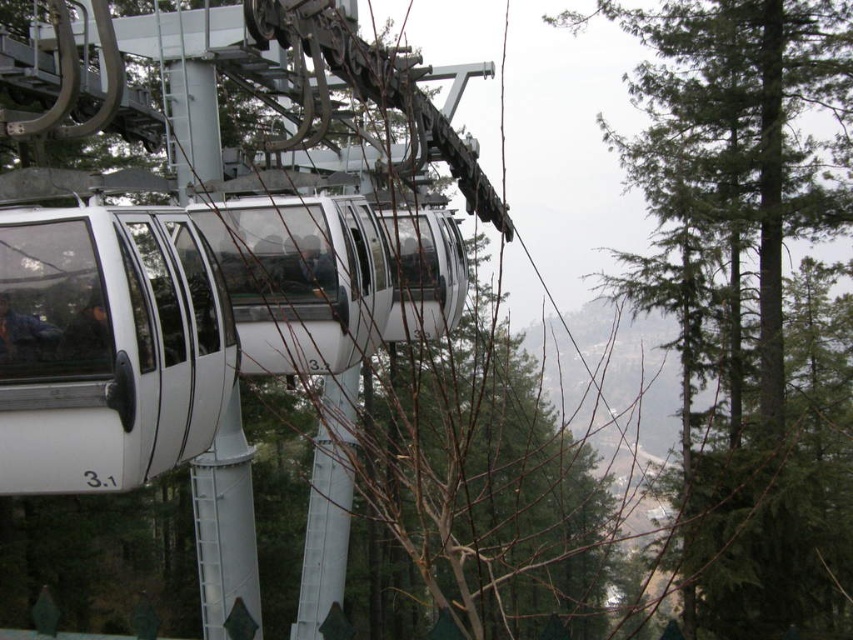
Is white glossy cable car at center above bare branches at center?

Yes.

The width and height of the screenshot is (853, 640). What do you see at coordinates (107, 346) in the screenshot? I see `white glossy cable car at center` at bounding box center [107, 346].

At what (x,y) coordinates should I click in order to perform the action: click on white glossy cable car at center. Please return your answer as a coordinate pair (x, y). Looking at the image, I should click on (107, 346).

The image size is (853, 640). What do you see at coordinates (749, 294) in the screenshot?
I see `green textured tree at upper right` at bounding box center [749, 294].

Is green textured tree at upper right taller than white glossy cable car at center?

Yes.

Where is `green textured tree at upper right`? green textured tree at upper right is located at coordinates (749, 294).

Which is behind, point (764, 564) or point (508, 432)?

The point (508, 432) is more distant.

Looking at this image, which is below, green textured tree at upper right or bare branches at center?

bare branches at center is below.

In order to click on green textured tree at upper right in this screenshot , I will do `click(749, 294)`.

Where is `green textured tree at upper right`? The height and width of the screenshot is (640, 853). green textured tree at upper right is located at coordinates (749, 294).